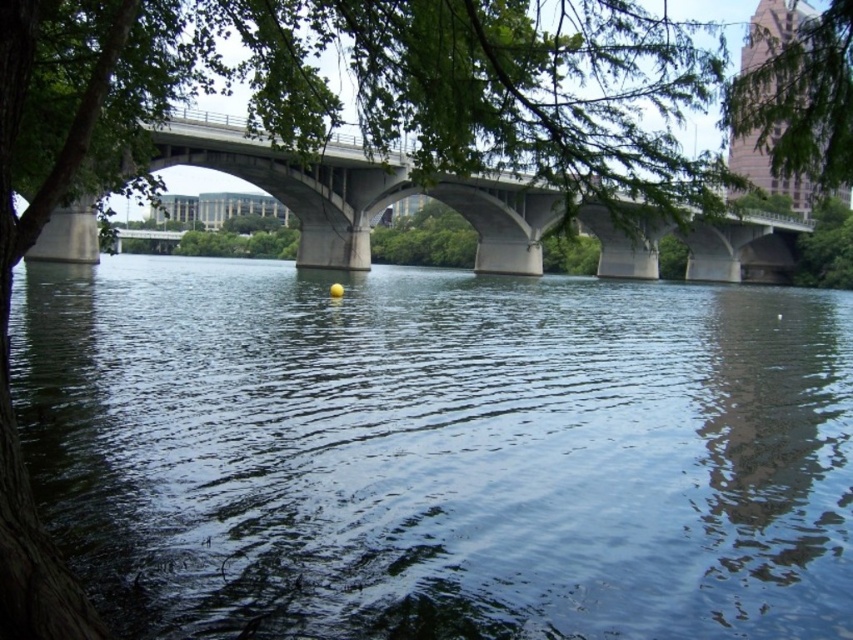
Does dark blue water at center have a smaller size compared to concrete bridge at center?

Indeed, dark blue water at center has a smaller size compared to concrete bridge at center.

Does dark blue water at center have a lesser height compared to concrete bridge at center?

No.

Locate an element on the screen. dark blue water at center is located at coordinates (438, 451).